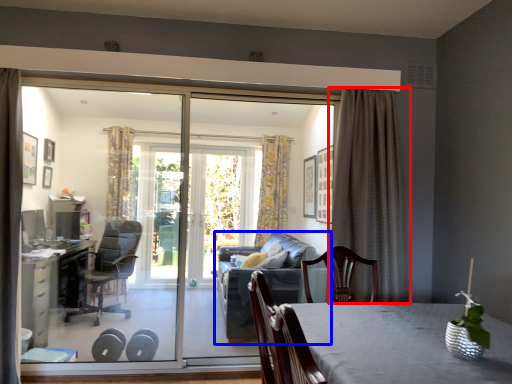
Question: Which point is closer to the camera, curtain (highlighted by a red box) or studio couch (highlighted by a blue box)?

Choices:
 (A) curtain
 (B) studio couch

Answer: (A)